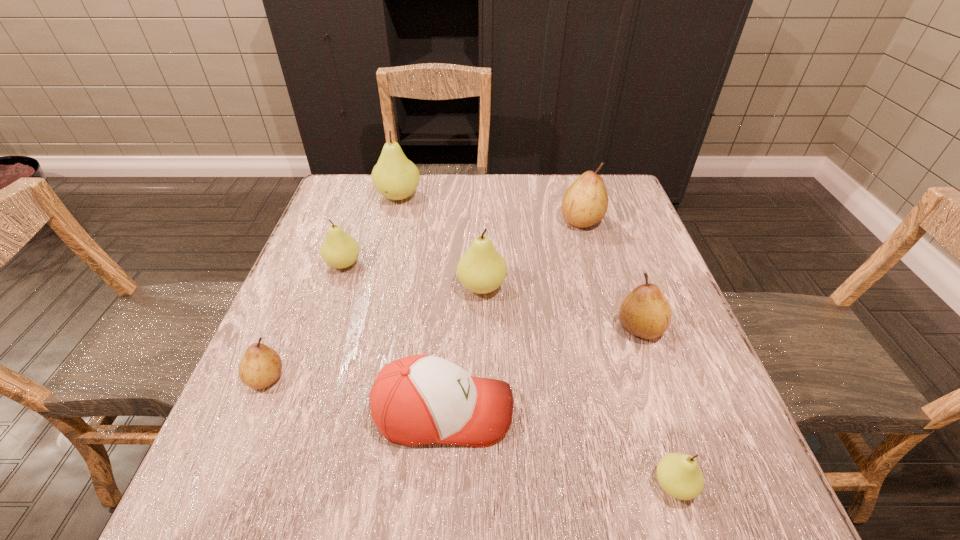
The height and width of the screenshot is (540, 960). I want to click on free space located 0.080m on the back of the nearest pear, so click(653, 418).

This screenshot has height=540, width=960. Find the location of `object situated at the near edge`. object situated at the near edge is located at coordinates (680, 476).

Find the location of `object located at the far left corner`. object located at the far left corner is located at coordinates (395, 177).

This screenshot has height=540, width=960. What are the coordinates of `object that is at the far right corner` in the screenshot? It's located at (585, 203).

Find the location of a particular element. The image size is (960, 540). object located at the near right corner is located at coordinates 680,476.

The image size is (960, 540). In order to click on vacant space at the far edge in this screenshot , I will do `click(495, 176)`.

The height and width of the screenshot is (540, 960). Find the location of `vacant space at the near edge of the desktop`. vacant space at the near edge of the desktop is located at coordinates (361, 483).

Identify the location of free spot at the left edge of the desktop. (305, 297).

Find the location of `vacant area at the right edge of the desktop`. vacant area at the right edge of the desktop is located at coordinates (634, 377).

In the image, there is a desktop. Where is `free space at the far left corner`? This screenshot has width=960, height=540. free space at the far left corner is located at coordinates (384, 197).